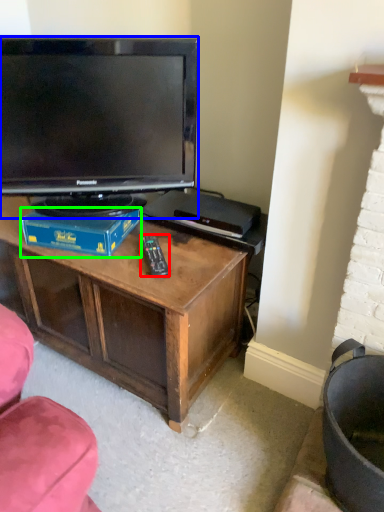
Question: Which is farther away from remote (highlighted by a red box)? television (highlighted by a blue box) or book (highlighted by a green box)?

Choices:
 (A) television
 (B) book

Answer: (A)